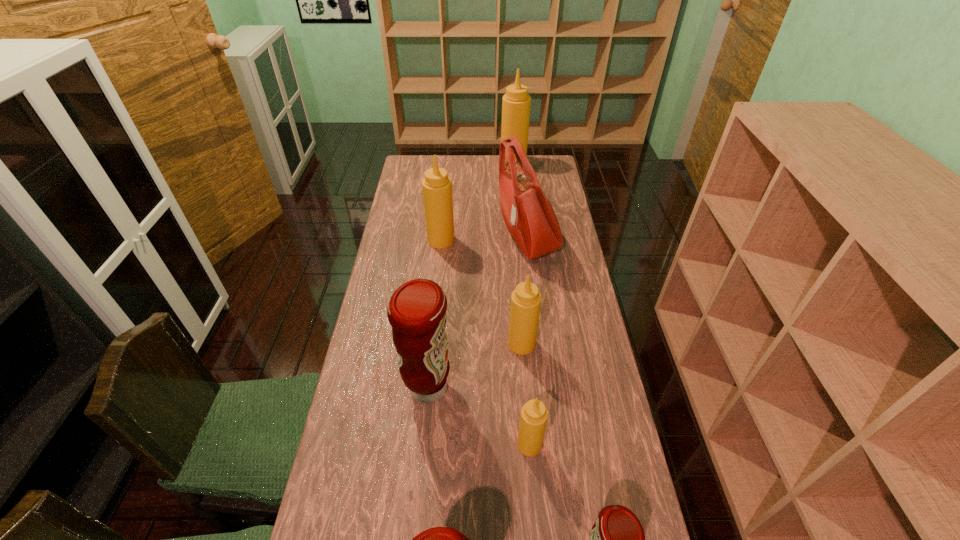
Where is `the smallest tan condiment`? The image size is (960, 540). the smallest tan condiment is located at coordinates (533, 419).

Where is `vacant position located on the front of the tallest condiment`? vacant position located on the front of the tallest condiment is located at coordinates (519, 217).

Image resolution: width=960 pixels, height=540 pixels. I want to click on vacant space located 0.050m on the front-facing side of the red handbag, so click(x=485, y=238).

Image resolution: width=960 pixels, height=540 pixels. I want to click on vacant space situated on the front-facing side of the red handbag, so click(405, 238).

What are the coordinates of `vacant space located 0.200m on the front-facing side of the red handbag` in the screenshot? It's located at (447, 238).

Locate an element on the screen. free space located 0.280m on the front of the second biggest tan condiment is located at coordinates (435, 301).

Where is `vacant area situated on the right of the fourth nearest object`? Image resolution: width=960 pixels, height=540 pixels. vacant area situated on the right of the fourth nearest object is located at coordinates (484, 387).

You are a GUI agent. You are given a task and a screenshot of the screen. Output one action in this format:
    pyautogui.click(x=<x>, y=<y>)
    Task: Click on the free space located on the left of the third farthest condiment
    The image size is (960, 540).
    Given the screenshot: What is the action you would take?
    pyautogui.click(x=486, y=344)

Locate an element on the screen. The height and width of the screenshot is (540, 960). vacant region located on the front of the fifth farthest condiment is located at coordinates (534, 497).

Where is `object situated at the far edge`? The image size is (960, 540). object situated at the far edge is located at coordinates (516, 103).